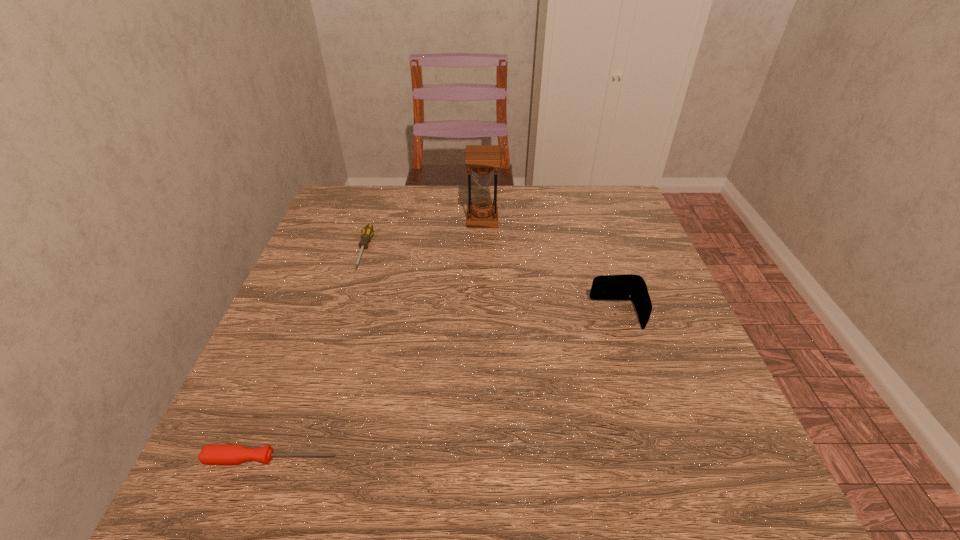
Where is `vacant space positioned 0.050m on the outer surface of the wallet`? vacant space positioned 0.050m on the outer surface of the wallet is located at coordinates (568, 315).

Find the location of a particular element. The width and height of the screenshot is (960, 540). free space located 0.390m on the outer surface of the wallet is located at coordinates (407, 315).

Image resolution: width=960 pixels, height=540 pixels. Identify the location of vacant space located at the tip of the farther screwdriver. (328, 362).

The height and width of the screenshot is (540, 960). I want to click on vacant space located 0.360m at the tip of the shortest object, so click(x=565, y=458).

Identify the location of hourglass that is positioned at the far edge. This screenshot has height=540, width=960. click(x=482, y=159).

Identify the location of screwdriver that is at the far edge. (367, 232).

Find the location of `object positioned at the near edge`. object positioned at the near edge is located at coordinates (221, 454).

Locate an element on the screen. The width and height of the screenshot is (960, 540). object present at the right edge is located at coordinates (631, 287).

Locate an element on the screen. The width and height of the screenshot is (960, 540). object that is at the far left corner is located at coordinates (367, 232).

Identify the location of object that is positioned at the near left corner. (221, 454).